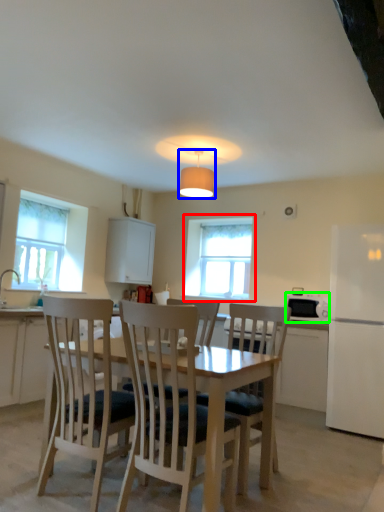
Question: Which object is the closest to the window (highlighted by a red box)? Choose among these: lamp (highlighted by a blue box) or appliance (highlighted by a green box).

Choices:
 (A) lamp
 (B) appliance

Answer: (A)